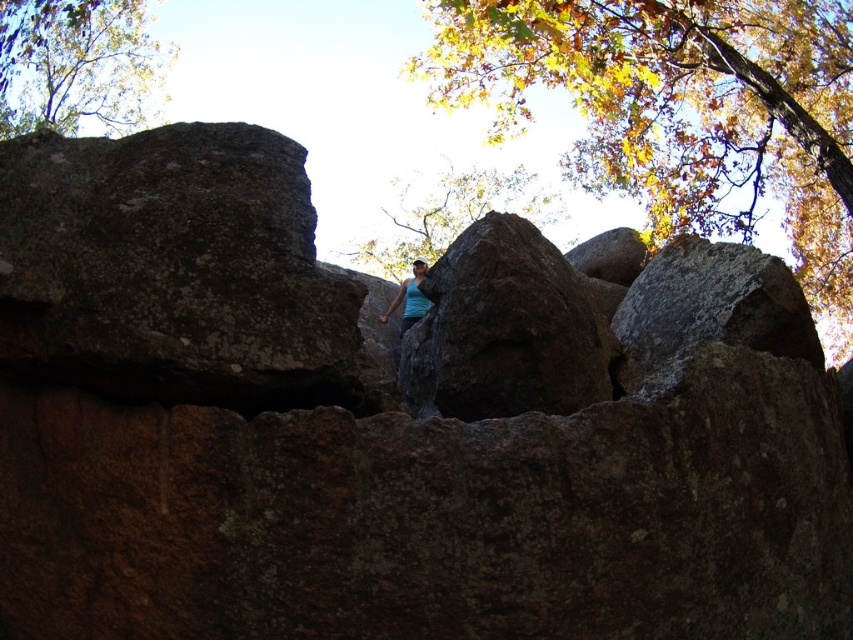
Question: Which point is farther to the camera?

Choices:
 (A) blue fabric tank top at center
 (B) yellow-green leaves at upper left
 (C) brown textured rock at upper center
 (D) brown rough rock at center

Answer: (C)

Question: Can you confirm if brown rough rock at center is thinner than brown textured rock at upper center?

Choices:
 (A) yes
 (B) no

Answer: (A)

Question: Does yellow-green leaves at upper left appear on the right side of blue fabric tank top at center?

Choices:
 (A) yes
 (B) no

Answer: (B)

Question: Among these points, which one is farthest from the camera?

Choices:
 (A) (396, 294)
 (B) (799, 60)

Answer: (B)

Question: Which of the following is the farthest from the observer?

Choices:
 (A) (424, 392)
 (B) (614, 77)
 (C) (424, 298)
 (D) (16, 35)

Answer: (D)

Question: Does brown rough rock at center appear under yellow-green leaves at upper left?

Choices:
 (A) yes
 (B) no

Answer: (A)